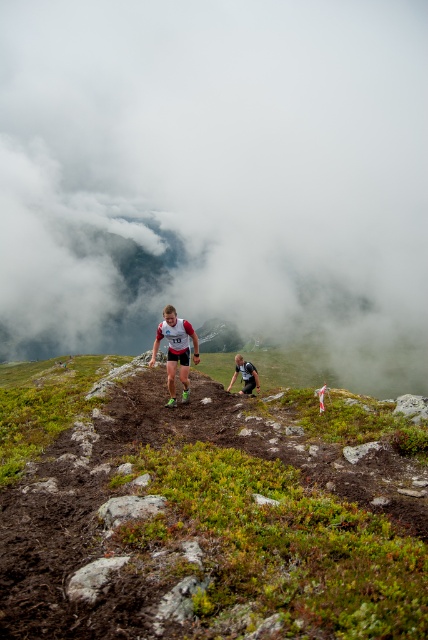
Question: Where is white mesh shirt at center located in relation to black fabric running suit at center in the image?

Choices:
 (A) left
 (B) right

Answer: (A)

Question: Estimate the real-world distances between objects in this image. Which object is closer to the black fabric running suit at center?

Choices:
 (A) white mesh shirt at center
 (B) white fluffy cloud at upper center

Answer: (A)

Question: Does white mesh shirt at center have a larger size compared to black fabric running suit at center?

Choices:
 (A) yes
 (B) no

Answer: (A)

Question: Considering the real-world distances, which object is farthest from the black fabric running suit at center?

Choices:
 (A) white mesh shirt at center
 (B) white fluffy cloud at upper center

Answer: (B)

Question: Which is nearer to the white fluffy cloud at upper center?

Choices:
 (A) white mesh shirt at center
 (B) black fabric running suit at center

Answer: (A)

Question: Does white fluffy cloud at upper center appear on the left side of black fabric running suit at center?

Choices:
 (A) no
 (B) yes

Answer: (B)